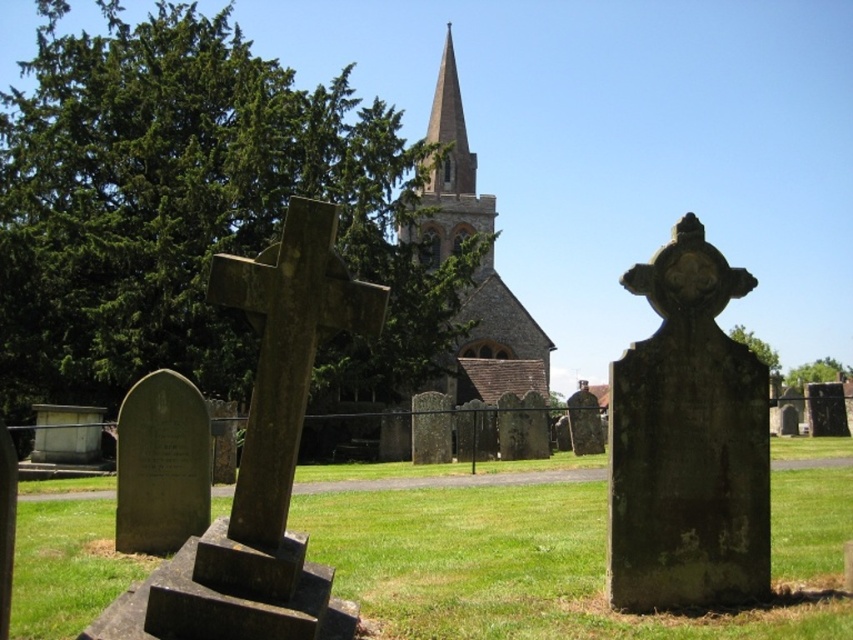
You are a visitor standing in the cemetery looking towards the church. You notice two brown stone structures at the center of the image. Which one is narrower between the brown stone cross at center and the brown stone spire at center?

The brown stone cross at center is thinner than the brown stone spire at center, so the brown stone cross at center is narrower.

You are a gardener standing at the edge of the cemetery. You need to mow the green grass at center and also check the brown stone cross at center. According to the scene, which object is lower in position?

The green grass at center is below brown stone cross at center, so the green grass at center is lower in position.